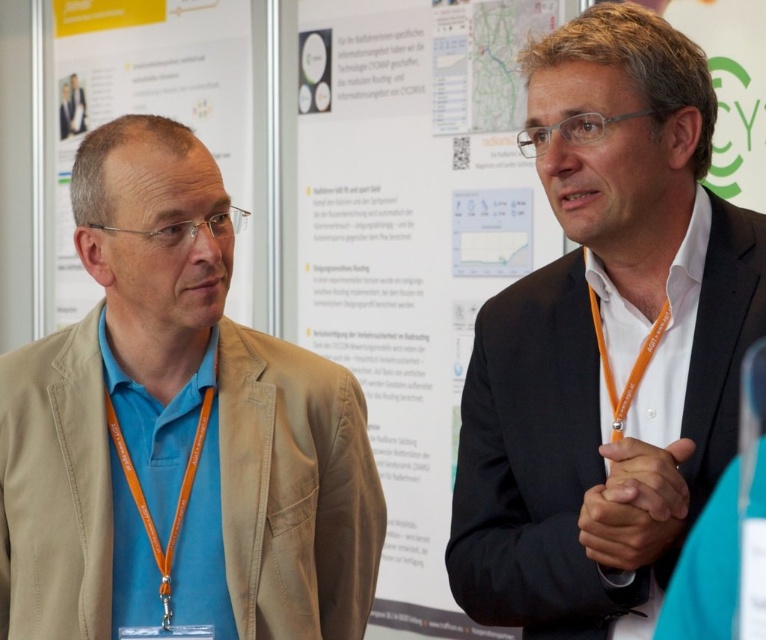
You are organizing a photo shoot and need to place two props next to the people in the image. The blue fabric shirt at left and the matte black suit at right must each have a prop placed beside them. If the total space available for both props is limited, which person should get a larger prop based on their clothing size?

The blue fabric shirt at left should get a larger prop because the matte black suit at right occupies less space than blue fabric shirt at left, indicating the blue fabric shirt area is bigger and can accommodate a larger prop.

You are an event planner who needs to arrange chairs for a small discussion between the matte black suit at right and the blue fabric shirt at left. The chairs must be placed exactly 24 inches apart. Based on their current positions, will the chairs need to be moved closer together or farther apart to meet this requirement?

The matte black suit at right is currently 21.26 inches from the blue fabric shirt at left. Since 21.26 inches is less than the required 24 inches, the chairs need to be moved farther apart to achieve the 24 inch spacing requirement.

You are an event organizer at the conference. You need to locate the attendee wearing the blue fabric shirt at left. According to the coordinates provided, where exactly is this attendee positioned in the image?

The blue fabric shirt at left is located at point (177, 432) in the image.